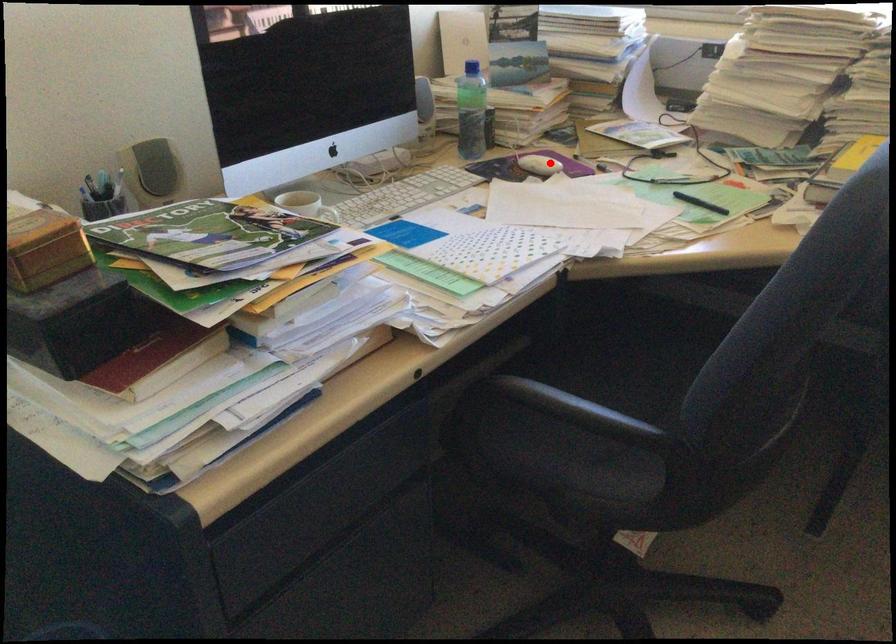
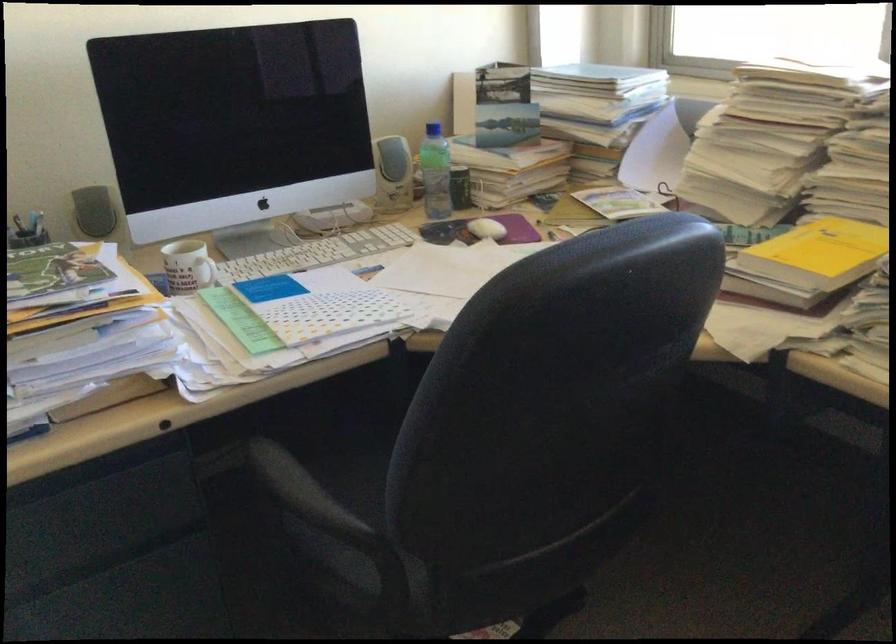
In the second image, find the point that corresponds to the highlighted location in the first image.

(487, 229)